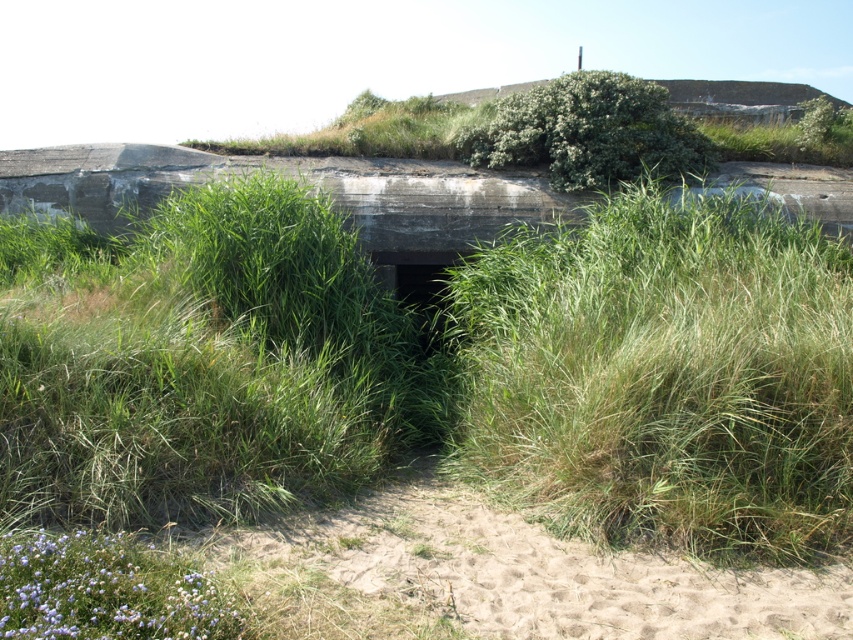
Is point (148, 564) in front of point (664, 177)?

Yes.

Consider the image. Does purple soft flower at lower left appear on the left side of green leafy bush at upper center?

Correct, you'll find purple soft flower at lower left to the left of green leafy bush at upper center.

Describe the element at coordinates (105, 589) in the screenshot. I see `purple soft flower at lower left` at that location.

What are the coordinates of `purple soft flower at lower left` in the screenshot? It's located at (105, 589).